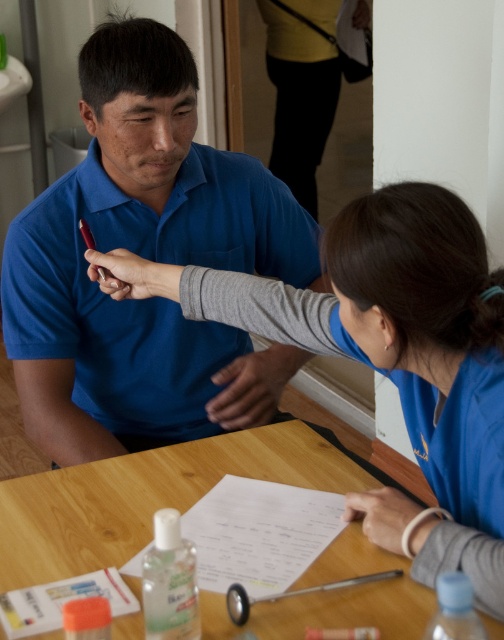
You are a patient in a clinic and see two shirts in the scene. The matte blue shirt at center and the blue fabric shirt at upper center. Which one is taller?

The matte blue shirt at center is taller than the blue fabric shirt at upper center.

You are a healthcare professional who needs to place a medical chart on the wooden table at center. The chart is 16 inches wide. Will it fit on the table without overlapping the matte blue shirt at center?

The distance between the matte blue shirt at center and the wooden table at center is 15.26 inches. Since the chart is 16 inches wide, it will overlap the matte blue shirt at center when placed on the table.

You are a patient in a clinic and see both the matte blue shirt at center and the blue fabric shirt at upper center. Which one is positioned higher up in the image?

The matte blue shirt at center is located above the blue fabric shirt at upper center, so it is positioned higher up in the image.